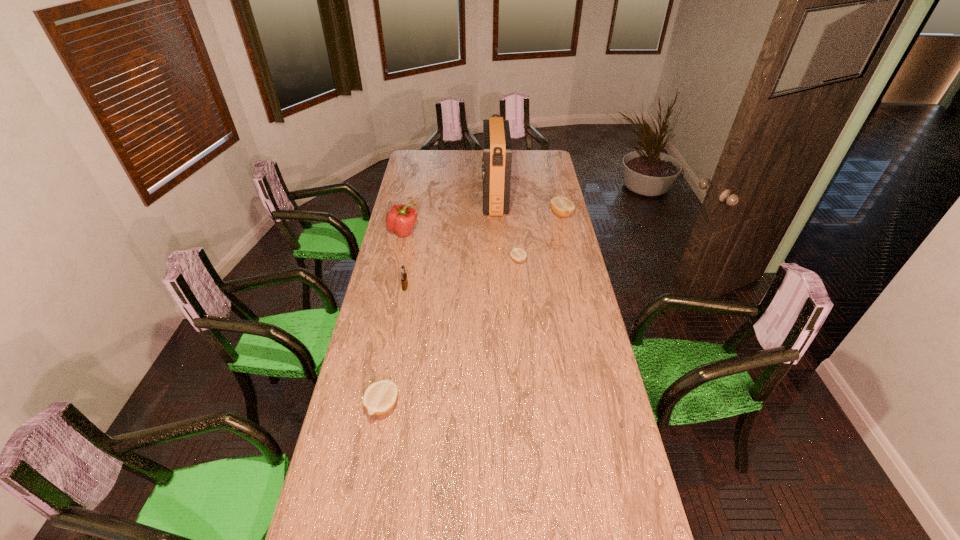
Locate an element on the screen. lemon that is the second closest to the shortest lemon is located at coordinates (380, 397).

Locate an element on the screen. The image size is (960, 540). vacant space that satisfies the following two spatial constraints: 1. on the back side of the second nearest lemon; 2. on the left side of the rightmost object is located at coordinates (514, 214).

Find the location of a particular element. This screenshot has width=960, height=540. blank space that satisfies the following two spatial constraints: 1. on the back side of the second nearest lemon; 2. on the front-facing side of the tallest object is located at coordinates (512, 200).

This screenshot has height=540, width=960. Identify the location of vacant space that satisfies the following two spatial constraints: 1. on the back side of the rightmost lemon; 2. on the right side of the fifth farthest object. (419, 214).